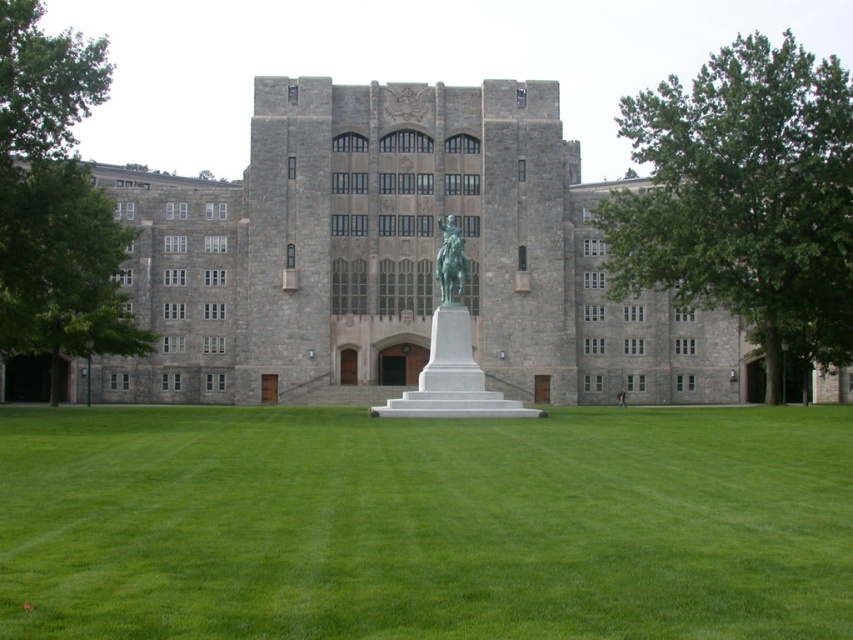
Question: Does white marble statue at center appear on the left side of bronze statue at center?

Choices:
 (A) yes
 (B) no

Answer: (A)

Question: Is green leafy tree at right smaller than green leafy tree at left?

Choices:
 (A) yes
 (B) no

Answer: (B)

Question: Considering the real-world distances, which object is closest to the white marble statue at center?

Choices:
 (A) green leafy tree at left
 (B) bronze statue at center
 (C) green grass at center

Answer: (B)

Question: Which point is farther to the camera?

Choices:
 (A) (798, 316)
 (B) (13, 29)
 (C) (534, 417)

Answer: (A)

Question: Does green grass at center appear over white marble statue at center?

Choices:
 (A) yes
 (B) no

Answer: (B)

Question: Based on their relative distances, which object is farther from the green grass at center?

Choices:
 (A) bronze statue at center
 (B) white marble statue at center
 (C) green leafy tree at right

Answer: (C)